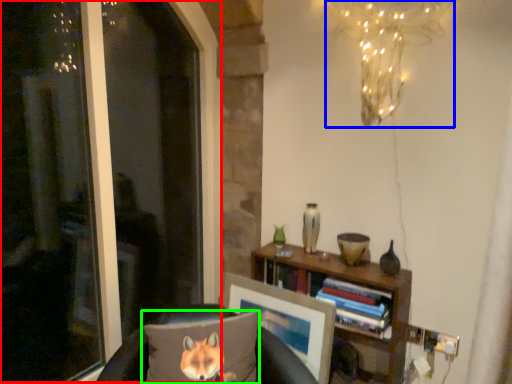
Question: Based on their relative distances, which object is nearer to window screen (highlighted by a red box)? Choose from lamp (highlighted by a blue box) and pillow (highlighted by a green box).

Choices:
 (A) lamp
 (B) pillow

Answer: (B)